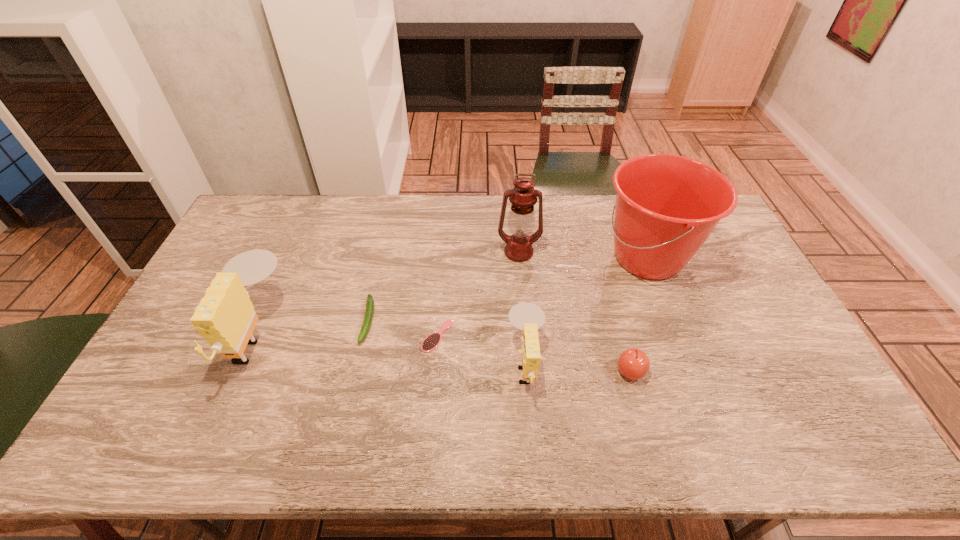
The height and width of the screenshot is (540, 960). Find the location of `the taller sponge`. the taller sponge is located at coordinates (225, 317).

You are a GUI agent. You are given a task and a screenshot of the screen. Output one action in this format:
    pyautogui.click(x=<x>, y=<y>)
    Task: Click on the left sponge
    This screenshot has width=960, height=540.
    Given the screenshot: What is the action you would take?
    [225, 317]

Locate an element on the screen. This screenshot has width=960, height=540. the fourth shortest object is located at coordinates (528, 317).

Find the location of a particular element. the right sponge is located at coordinates (528, 317).

The image size is (960, 540). Identify the location of oil lamp. (521, 219).

At what (x,y) coordinates should I click in order to perform the action: click on bucket. Please return your answer as a coordinate pair (x, y). Image resolution: width=960 pixels, height=540 pixels. Looking at the image, I should click on (666, 206).

Where is `zucchini`? This screenshot has width=960, height=540. zucchini is located at coordinates (368, 317).

The image size is (960, 540). What are the coordinates of `the sixth object from right to left` in the screenshot? It's located at (368, 317).

This screenshot has width=960, height=540. I want to click on the shortest object, so click(432, 341).

Identify the location of the third object from left to right. This screenshot has width=960, height=540. (432, 341).